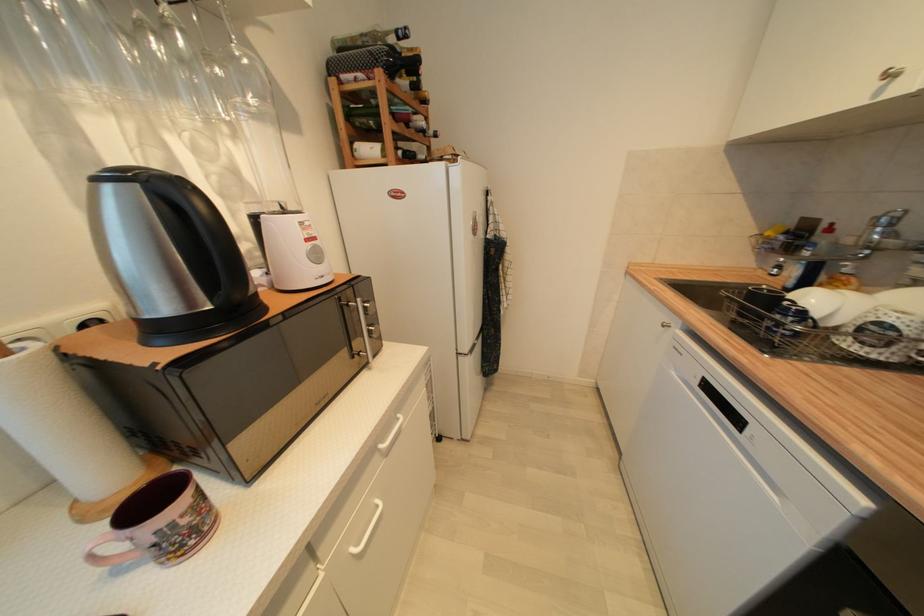
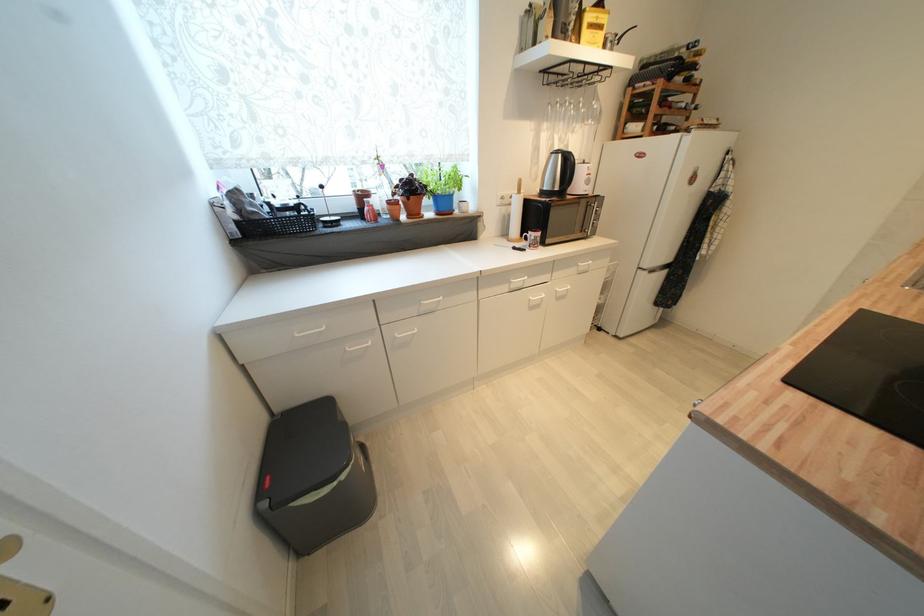
Locate, in the second image, the point that corresponds to pixel 402 130 in the first image.

(664, 114)